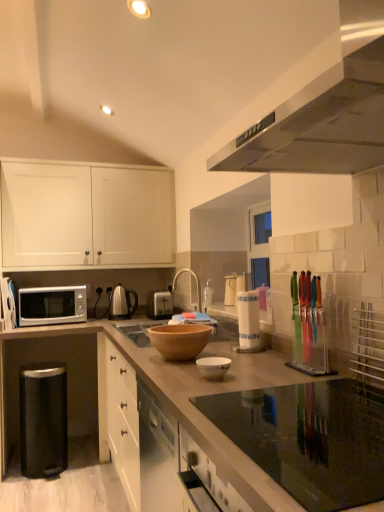
This screenshot has width=384, height=512. Find the location of `vacant space underneath silver metallic microwave at lower left (from a real-world perspective)`. vacant space underneath silver metallic microwave at lower left (from a real-world perspective) is located at coordinates (74, 442).